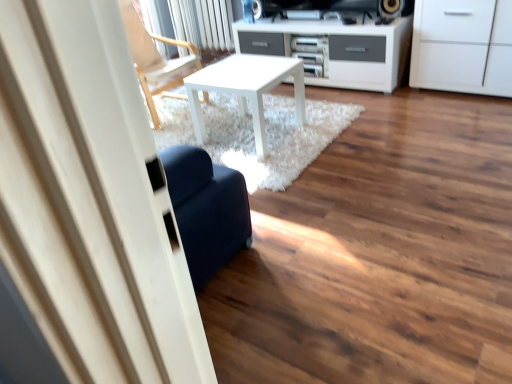
This screenshot has width=512, height=384. Find the location of `vacant area located to the right-hand side of white matte table at center`. vacant area located to the right-hand side of white matte table at center is located at coordinates (321, 120).